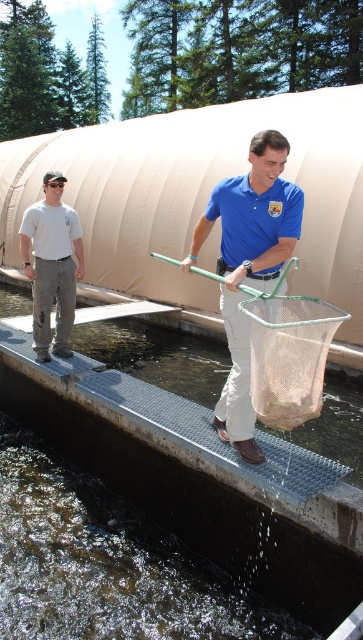
Looking at this image, you are a worker at the fish hatchery and need to locate the metal mesh net at center. According to the coordinates provided, where would you find it?

The metal mesh net at center is located at point [288,355].